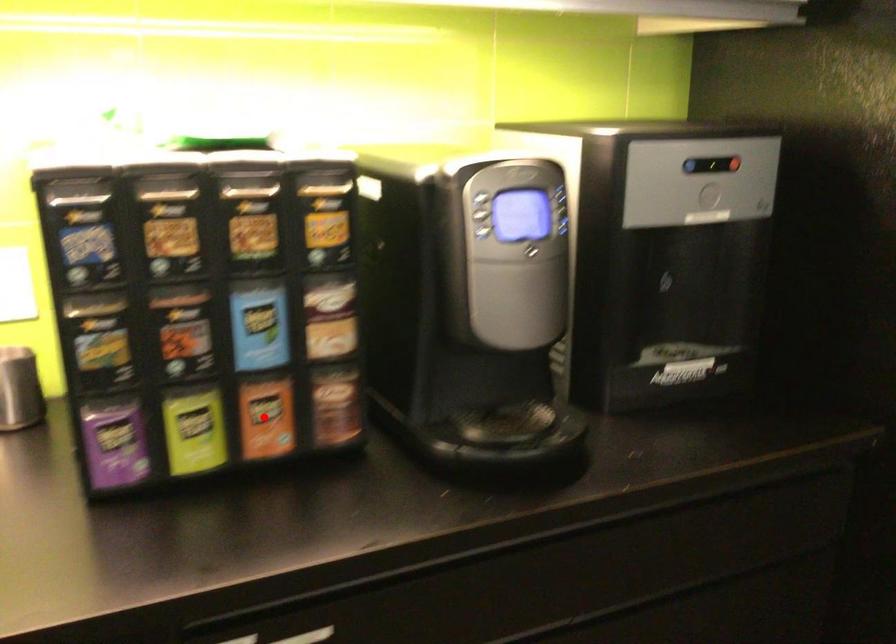
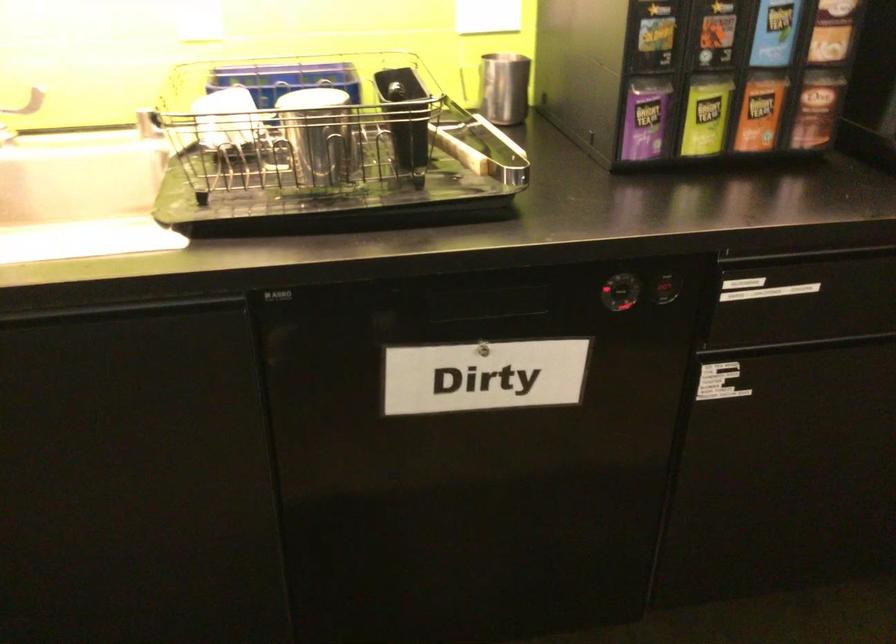
Find the pixel in the second image that matches the highlighted location in the first image.

(760, 111)